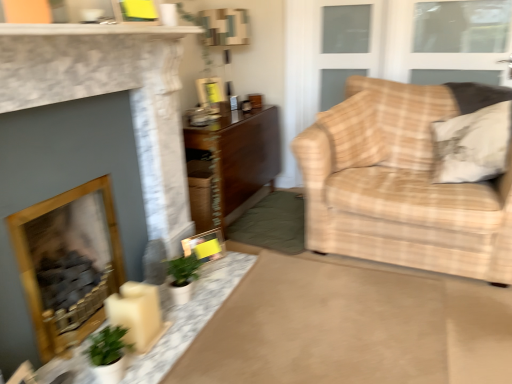
Question: Which direction should I rotate to face matte plastic picture frame at upper center, positioned as the 1th picture frame in back-to-front order, — up or down?

Choices:
 (A) down
 (B) up

Answer: (B)

Question: Is clear glass window at upper right, which appears as the first window when ordered from the bottom, directly adjacent to white marble table at center, the 2th table positioned from the top?

Choices:
 (A) yes
 (B) no

Answer: (B)

Question: Is clear glass window at upper right, arranged as the 2th window when viewed from the top, not near white marble table at center, the 1th table positioned from the front?

Choices:
 (A) yes
 (B) no

Answer: (A)

Question: Can you confirm if clear glass window at upper right, arranged as the 2th window when viewed from the top, is shorter than white marble table at center, the 2th table positioned from the top?

Choices:
 (A) no
 (B) yes

Answer: (A)

Question: From the image's perspective, would you say clear glass window at upper right, arranged as the 2th window when viewed from the top, is positioned over white marble table at center, the 2th table positioned from the top?

Choices:
 (A) yes
 (B) no

Answer: (A)

Question: Is clear glass window at upper right, arranged as the 2th window when viewed from the top, wider than white marble table at center, the 1th table when ordered from bottom to top?

Choices:
 (A) no
 (B) yes

Answer: (A)

Question: Is clear glass window at upper right, arranged as the 2th window when viewed from the top, turned away from white marble table at center, the 1th table positioned from the front?

Choices:
 (A) no
 (B) yes

Answer: (A)

Question: From the image's perspective, does wooden table at center, placed as the second table when sorted from front to back, appear higher than wooden fireplace at left, which is the second fireplace from front to back?

Choices:
 (A) no
 (B) yes

Answer: (B)

Question: Would you say wooden table at center, placed as the second table when sorted from front to back, is outside wooden fireplace at left, which is the second fireplace from front to back?

Choices:
 (A) no
 (B) yes

Answer: (B)

Question: Considering the relative sizes of wooden table at center, the second table when ordered from bottom to top, and wooden fireplace at left, which is the second fireplace from front to back, in the image provided, is wooden table at center, the second table when ordered from bottom to top, shorter than wooden fireplace at left, which is the second fireplace from front to back,?

Choices:
 (A) no
 (B) yes

Answer: (A)

Question: Considering the relative positions of wooden table at center, the second table when ordered from bottom to top, and wooden fireplace at left, which is the second fireplace from front to back, in the image provided, is wooden table at center, the second table when ordered from bottom to top, to the left of wooden fireplace at left, which is the second fireplace from front to back, from the viewer's perspective?

Choices:
 (A) no
 (B) yes

Answer: (A)

Question: Does wooden table at center, the second table when ordered from bottom to top, contain wooden fireplace at left, which is the second fireplace from front to back?

Choices:
 (A) yes
 (B) no

Answer: (B)

Question: Can you confirm if wooden table at center, placed as the 1th table when sorted from back to front, is thinner than wooden fireplace at left, which is the second fireplace from front to back?

Choices:
 (A) yes
 (B) no

Answer: (B)

Question: From a real-world perspective, is wooden fireplace at left, the first fireplace positioned from the back, on wooden table at center, placed as the 1th table when sorted from back to front?

Choices:
 (A) no
 (B) yes

Answer: (B)